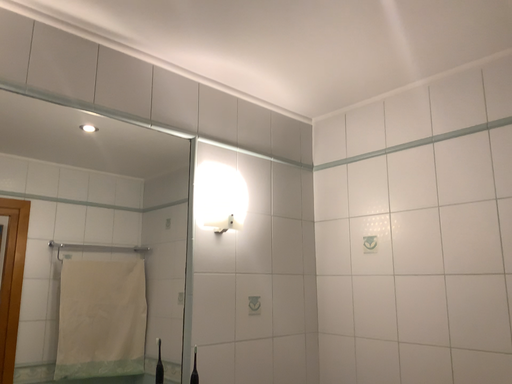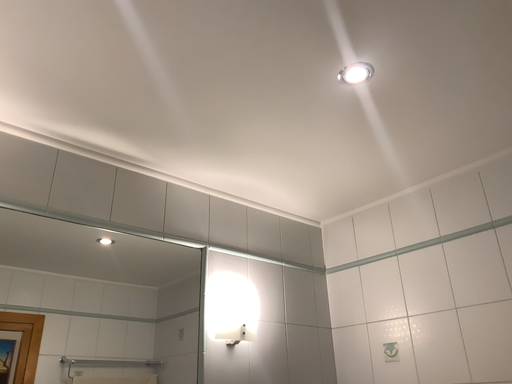
Question: Which way did the camera rotate in the video?

Choices:
 (A) rotated upward
 (B) rotated downward

Answer: (A)